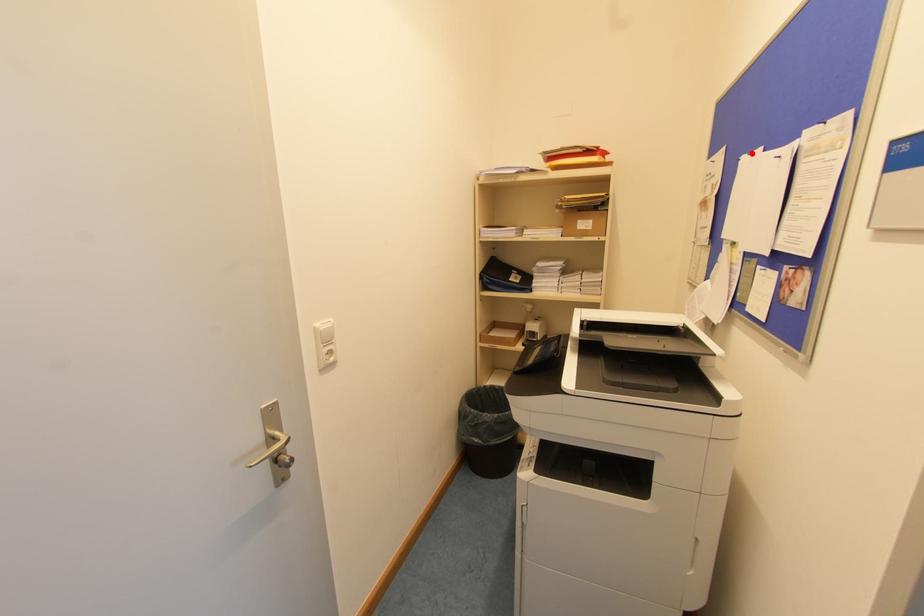
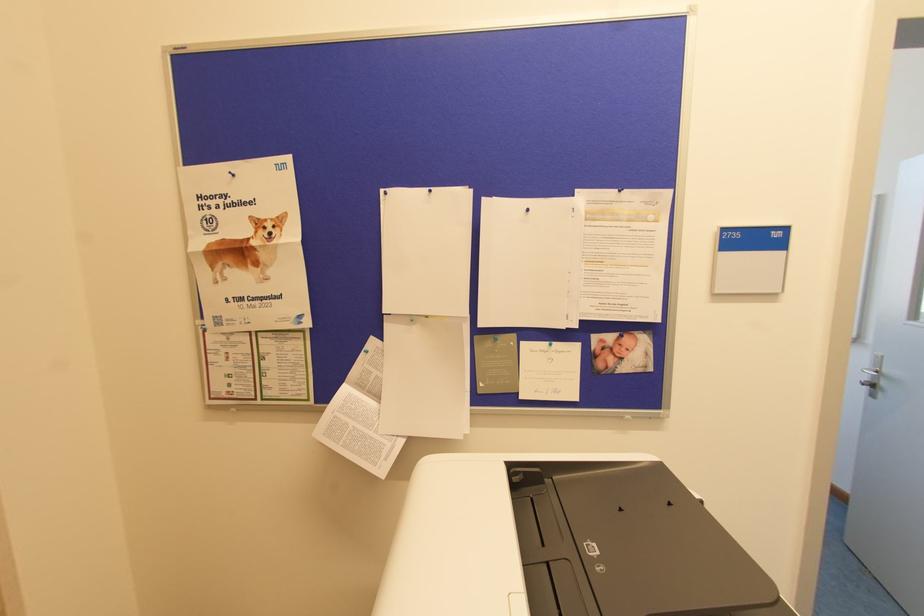
Question: I am providing you with two images of the same scene from different viewpoints. A red point is marked on the first image. Can you still see the location of the red point in image 2?

Choices:
 (A) Yes
 (B) No

Answer: (A)